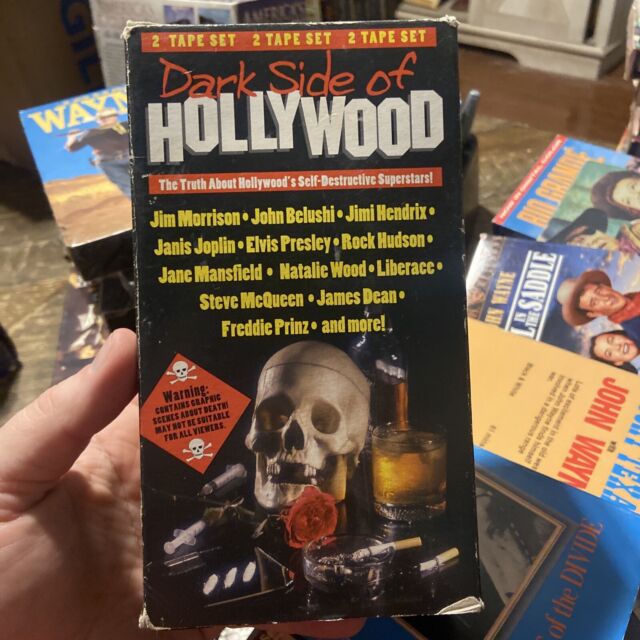
In order to click on vhs tape in this screenshot , I will do `click(282, 280)`.